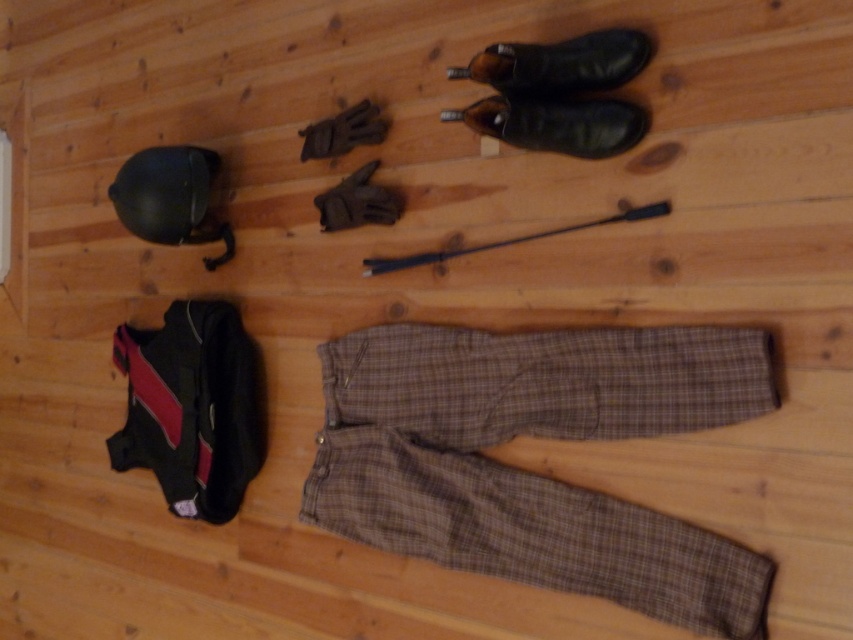
Question: Where is brown plaid pants at center located in relation to leather boot at upper center in the image?

Choices:
 (A) left
 (B) right

Answer: (A)

Question: Which point is closer to the camera taking this photo?

Choices:
 (A) (593, 592)
 (B) (175, 161)
 (C) (590, 109)
 (D) (506, 64)

Answer: (D)

Question: Which point is farther to the camera?

Choices:
 (A) leather boot at upper center
 (B) matte black helmet at upper left
 (C) brown plaid pants at center
 (D) leather shoe at upper center

Answer: (B)

Question: Is brown plaid pants at center bigger than matte black helmet at upper left?

Choices:
 (A) yes
 (B) no

Answer: (A)

Question: Where is matte black helmet at upper left located in relation to leather shoe at upper center in the image?

Choices:
 (A) below
 (B) above

Answer: (A)

Question: Which object is positioned farthest from the matte black helmet at upper left?

Choices:
 (A) leather boot at upper center
 (B) leather shoe at upper center

Answer: (A)